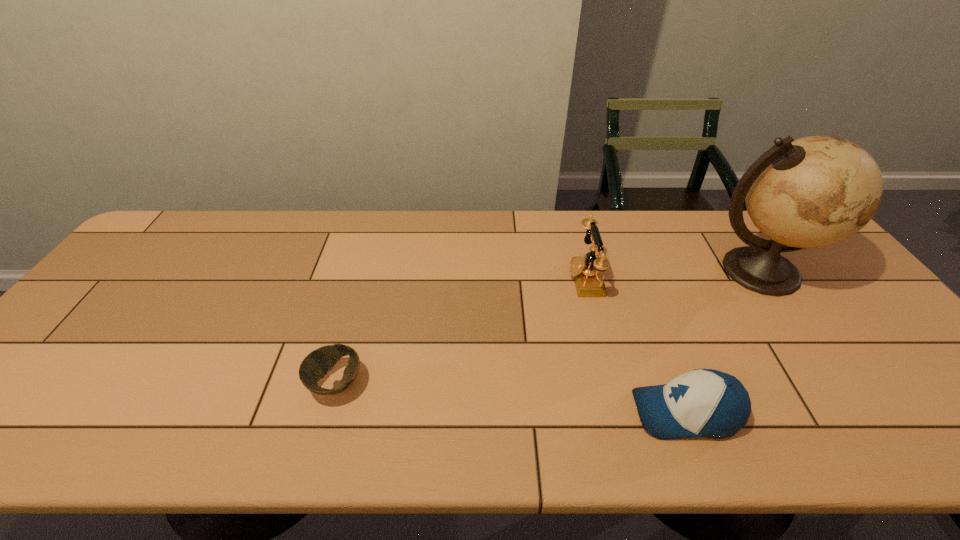
Where is `vacant point located between the third tallest object and the globe`? vacant point located between the third tallest object and the globe is located at coordinates (722, 342).

I want to click on vacant area that lies between the shortest object and the third tallest object, so click(x=511, y=398).

Locate an element on the screen. This screenshot has width=960, height=540. vacant space in between the shortest object and the baseball cap is located at coordinates (511, 398).

The height and width of the screenshot is (540, 960). I want to click on unoccupied position between the rightmost object and the leftmost object, so (x=547, y=327).

At what (x,y) coordinates should I click in order to perform the action: click on the closest object to the tallest object. Please return your answer as a coordinate pair (x, y). The image size is (960, 540). Looking at the image, I should click on (709, 403).

Locate which object ranks third in proximity to the globe. Please provide its 2D coordinates. Your answer should be formatted as a tuple, i.e. [(x, y)], where the tuple contains the x and y coordinates of a point satisfying the conditions above.

[(316, 364)]

Identify the location of free region that satisfies the following two spatial constraints: 1. on the dial of the third shortest object; 2. on the front side of the bowl. (611, 383).

This screenshot has height=540, width=960. I want to click on free space that satisfies the following two spatial constraints: 1. on the dial of the telephone; 2. on the front side of the bowl, so click(611, 383).